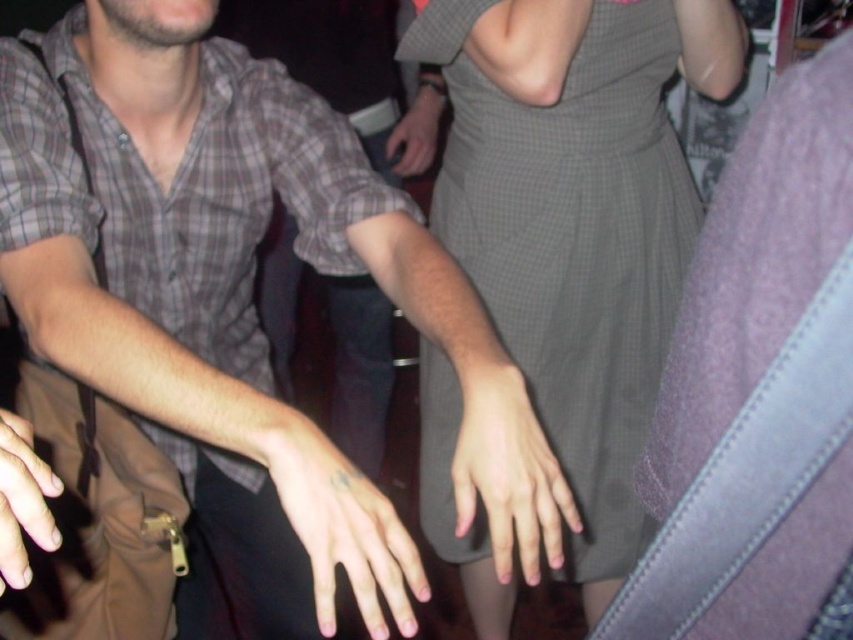
Who is higher up, matte plaid shirt at center or smooth skin hand at lower left?

smooth skin hand at lower left

Between matte plaid shirt at center and smooth skin hand at lower left, which one has less height?

With less height is smooth skin hand at lower left.

Which is behind, point (302, 486) or point (28, 534)?

Positioned behind is point (28, 534).

Locate an element on the screen. matte plaid shirt at center is located at coordinates (250, 294).

Is matte plaid shirt at center positioned at the back of pale skin tattooed hand at center?

Yes, it is.

Which is in front, point (126, 13) or point (392, 580)?

Positioned in front is point (392, 580).

Locate an element on the screen. The image size is (853, 640). matte plaid shirt at center is located at coordinates (250, 294).

Who is taller, matte plaid shirt at center or pink matte hand at center?

matte plaid shirt at center

Who is shorter, matte plaid shirt at center or pink matte hand at center?

With less height is pink matte hand at center.

Who is more distant from viewer, [312,488] or [503,499]?

Point [503,499]

Find the location of a particular element. The image size is (853, 640). matte plaid shirt at center is located at coordinates (250, 294).